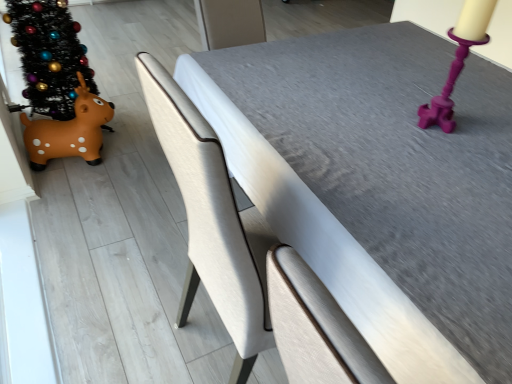
At what (x,y) coordinates should I click in order to perform the action: click on vacant point to the left of textured gray table at center. Please return your answer as a coordinate pair (x, y). This screenshot has height=384, width=512. Looking at the image, I should click on (108, 243).